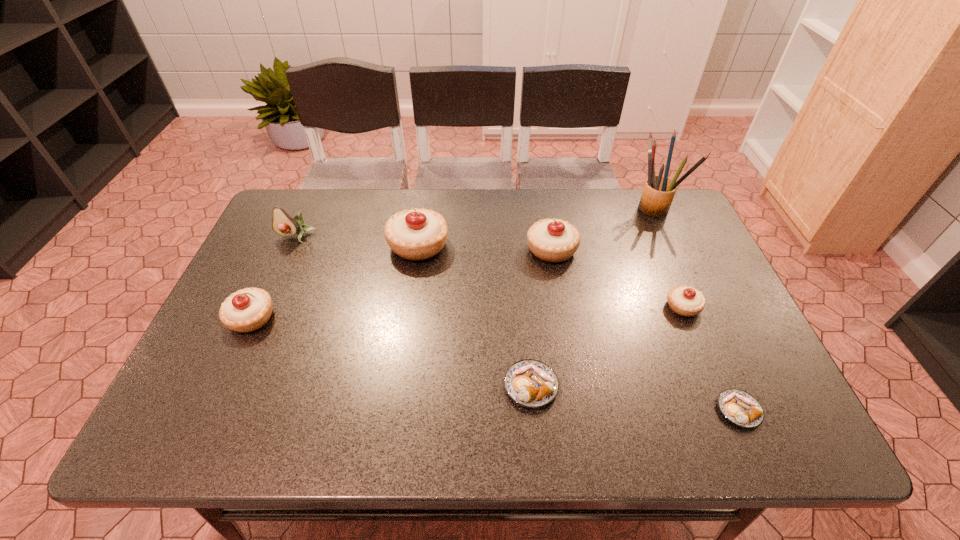
What are the coordinates of `brown pencil box` in the screenshot? It's located at (658, 193).

Locate an element on the screen. The height and width of the screenshot is (540, 960). pencil box is located at coordinates (658, 193).

The image size is (960, 540). What are the coordinates of `the sixth object from right to left` in the screenshot? It's located at (417, 234).

In order to click on the third beige pastry from right to left in this screenshot , I will do `click(417, 234)`.

Identify the location of avocado. (283, 224).

The width and height of the screenshot is (960, 540). What are the coordinates of `the second tallest pastry` in the screenshot? It's located at (553, 240).

You are a GUI agent. You are given a task and a screenshot of the screen. Output one action in this format:
    pyautogui.click(x=<x>, y=<y>)
    Task: Click on the second biggest beige pastry
    This screenshot has height=540, width=960.
    Given the screenshot: What is the action you would take?
    pyautogui.click(x=553, y=240)

The width and height of the screenshot is (960, 540). What are the coordinates of `the leftmost beige pastry` in the screenshot? It's located at [x=249, y=309].

This screenshot has height=540, width=960. Identify the location of the third tallest pastry. tap(249, 309).

Locate an element on the screen. The width and height of the screenshot is (960, 540). the smallest beige pastry is located at coordinates (687, 301).